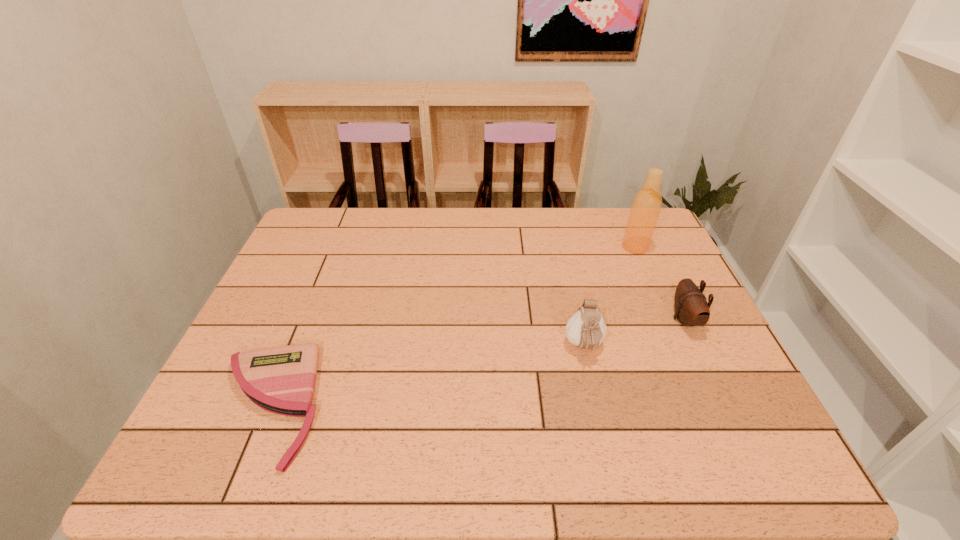
You are a GUI agent. You are given a task and a screenshot of the screen. Output one action in this format:
    pyautogui.click(x=<x>, y=<y>)
    Task: Click on the free space at the far edge
    The image size is (960, 540).
    Given the screenshot: What is the action you would take?
    pyautogui.click(x=452, y=221)

The height and width of the screenshot is (540, 960). In the image, there is a desktop. In order to click on vacant area at the right edge in this screenshot , I will do `click(679, 275)`.

What are the coordinates of `free space at the far right corner of the desktop` in the screenshot? It's located at (609, 212).

The height and width of the screenshot is (540, 960). I want to click on free space between the tallest object and the left pouch, so click(610, 297).

The height and width of the screenshot is (540, 960). In order to click on vacant area that lies between the shortest object and the right pouch in this screenshot , I will do `click(476, 362)`.

Identify the location of free space between the second object from left to right and the shortest object. click(x=425, y=376).

The image size is (960, 540). I want to click on vacant point located between the shorter pouch and the farthest object, so [660, 283].

In order to click on vacant space that is in between the leftmost object and the third tallest object in this screenshot , I will do `click(476, 362)`.

I want to click on unoccupied position between the wristlet and the farthest object, so click(451, 326).

Where is `free point between the left pouch and the shortest object`? free point between the left pouch and the shortest object is located at coordinates (425, 376).